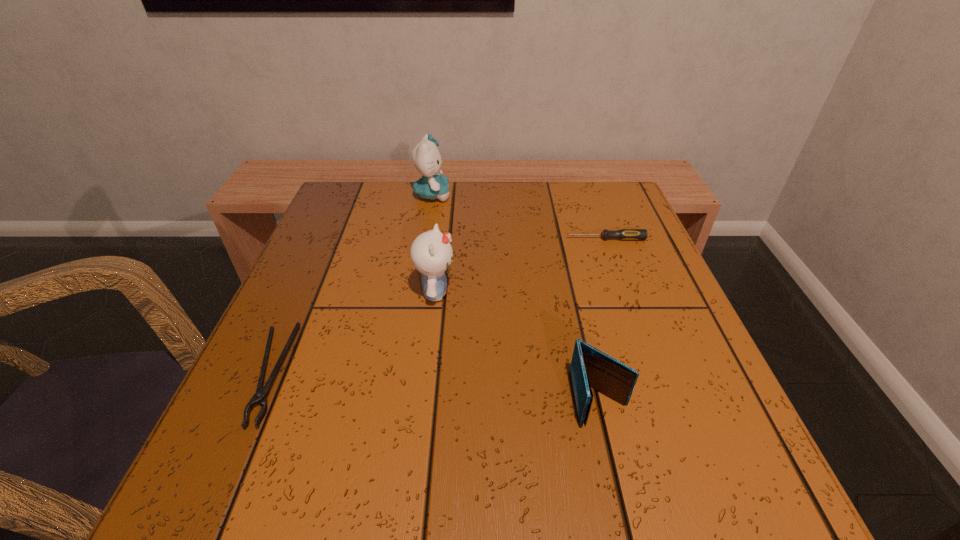
This screenshot has height=540, width=960. Identify the location of vacant space positioned 0.270m insert the screwdriver into a screw head. (446, 239).

Where is `free space located insert the screwdriver into a screw head`? The width and height of the screenshot is (960, 540). free space located insert the screwdriver into a screw head is located at coordinates (540, 239).

Identify the location of free spot located insert the screwdriver into a screw head. The width and height of the screenshot is (960, 540). (509, 239).

You are a GUI agent. You are given a task and a screenshot of the screen. Output one action in this format:
    pyautogui.click(x=<x>, y=<y>)
    Task: Click on the blank space located 0.260m on the right of the tongs
    This screenshot has height=540, width=960.
    Given the screenshot: What is the action you would take?
    pyautogui.click(x=444, y=374)

Where is `object that is at the far edge`? This screenshot has height=540, width=960. object that is at the far edge is located at coordinates (433, 185).

The height and width of the screenshot is (540, 960). What are the coordinates of `object that is at the left edge` in the screenshot? It's located at (260, 397).

I want to click on wallet that is at the right edge, so click(590, 367).

Locate an element on the screen. This screenshot has height=540, width=960. screwdriver positioned at the right edge is located at coordinates click(624, 234).

Locate an element on the screen. free space at the far edge of the desktop is located at coordinates 445,202.

This screenshot has height=540, width=960. In the image, there is a desktop. In order to click on vacant space at the near edge in this screenshot , I will do `click(324, 498)`.